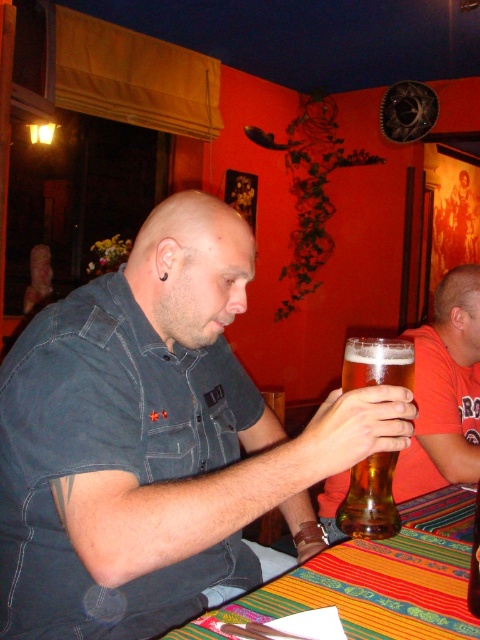
In the scene shown: Which is above, denim shirt at center or multicolored woven mat at lower center?

denim shirt at center

Is point (203, 403) less distant than point (356, 564)?

No, it is behind (356, 564).

Who is more distant from viewer, (272,465) or (236,618)?

Point (272,465)

Identify the location of denim shirt at center. This screenshot has height=640, width=480. (155, 440).

Can you confirm if multicolored woven mat at lower center is bigger than golden glass beer at center?

Correct, multicolored woven mat at lower center is larger in size than golden glass beer at center.

Between multicolored woven mat at lower center and golden glass beer at center, which one has less height?

Standing shorter between the two is multicolored woven mat at lower center.

Identify the location of multicolored woven mat at lower center. This screenshot has height=640, width=480. (377, 579).

Does denim shirt at center have a larger size compared to golden glass beer at center?

Indeed, denim shirt at center has a larger size compared to golden glass beer at center.

Which is behind, point (295, 484) or point (375, 538)?

Positioned behind is point (375, 538).

Is point (193, 200) positioned behind point (387, 484)?

Yes, it is.

Where is `denim shirt at center`? The height and width of the screenshot is (640, 480). denim shirt at center is located at coordinates (155, 440).